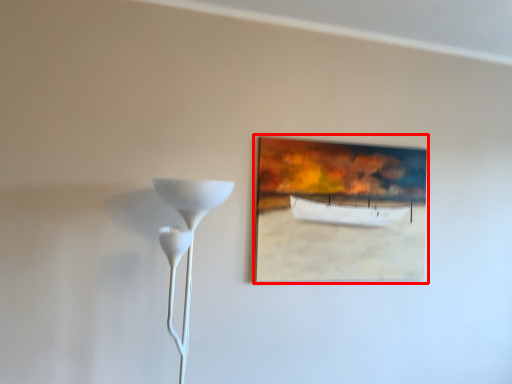
Question: From the image's perspective, what is the correct spatial positioning of picture frame (annotated by the red box) in reference to lamp?

Choices:
 (A) below
 (B) above

Answer: (B)